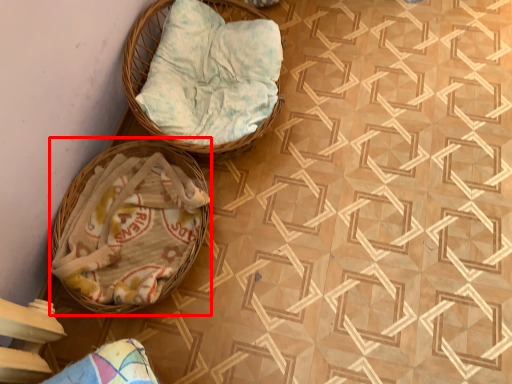
Question: Where is basket (annotated by the red box) located in relation to basket in the image?

Choices:
 (A) right
 (B) left

Answer: (B)